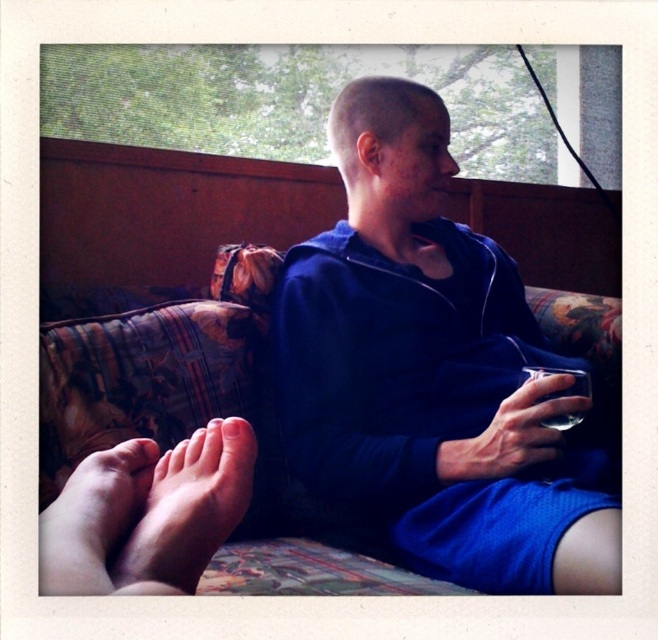
Question: Does blue fabric shirt at center come in front of pink soft skin at lower left?

Choices:
 (A) yes
 (B) no

Answer: (B)

Question: Which point is farther to the camera?

Choices:
 (A) (282, 305)
 (B) (149, 531)
 (C) (320, 428)

Answer: (A)

Question: Which point is farther to the camera?

Choices:
 (A) (93, 499)
 (B) (372, 332)

Answer: (B)

Question: Can you confirm if floral fabric couch at center is positioned above dry skin feet at lower left?

Choices:
 (A) no
 (B) yes

Answer: (B)

Question: Among these objects, which one is nearest to the camera?

Choices:
 (A) pink soft skin at lower left
 (B) blue fabric shirt at center
 (C) dry skin feet at lower left

Answer: (A)

Question: Is dry skin feet at lower left thinner than pink soft skin at lower left?

Choices:
 (A) yes
 (B) no

Answer: (A)